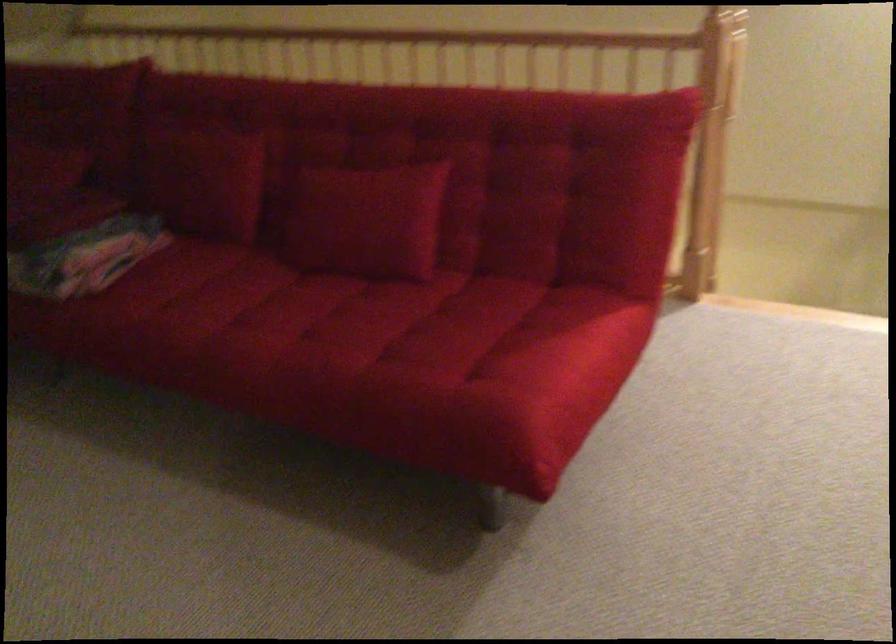
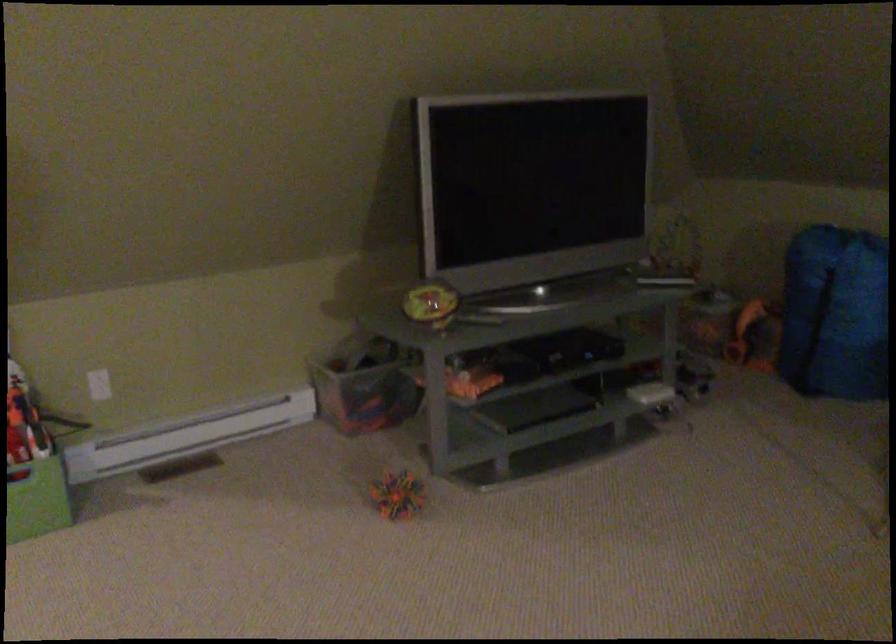
First-person continuous shooting, in which direction is the camera rotating?

The rotation direction of the camera is left-down.